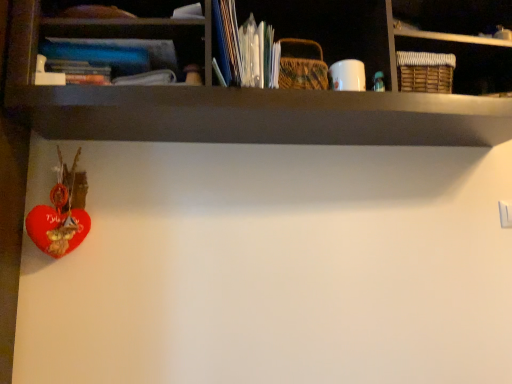
Where is `blue hardcover book at upper left`? blue hardcover book at upper left is located at coordinates (115, 54).

This screenshot has width=512, height=384. Describe the element at coordinates (115, 54) in the screenshot. I see `blue hardcover book at upper left` at that location.

Consider the image. In order to face blue hardcover book at upper left, should I rotate leftwards or rightwards?

Turn left by 19.009 degrees to look at blue hardcover book at upper left.

Locate an element on the screen. velvet red heart at lower left is located at coordinates (61, 213).

Image resolution: width=512 pixels, height=384 pixels. What do you see at coordinates (61, 213) in the screenshot? I see `velvet red heart at lower left` at bounding box center [61, 213].

This screenshot has width=512, height=384. I want to click on blue hardcover book at upper left, so click(x=115, y=54).

Considering the relative positions of blue hardcover book at upper left and velvet red heart at lower left in the image provided, is blue hardcover book at upper left to the right of velvet red heart at lower left from the viewer's perspective?

Yes, blue hardcover book at upper left is to the right of velvet red heart at lower left.

Is blue hardcover book at upper left in front of velvet red heart at lower left?

Yes, the depth of blue hardcover book at upper left is less than that of velvet red heart at lower left.

Which is in front, point (42, 42) or point (76, 241)?

The point (42, 42) is in front.

From the image's perspective, which one is positioned higher, blue hardcover book at upper left or velvet red heart at lower left?

blue hardcover book at upper left.

From a real-world perspective, which object rests below the other?

velvet red heart at lower left is physically lower.

In terms of width, does blue hardcover book at upper left look wider or thinner when compared to velvet red heart at lower left?

blue hardcover book at upper left is wider than velvet red heart at lower left.

Between blue hardcover book at upper left and velvet red heart at lower left, which one has more height?

velvet red heart at lower left.

Looking at the image, does blue hardcover book at upper left seem bigger or smaller compared to velvet red heart at lower left?

Clearly, blue hardcover book at upper left is smaller in size than velvet red heart at lower left.

Would you say blue hardcover book at upper left is inside or outside velvet red heart at lower left?

blue hardcover book at upper left is spatially situated outside velvet red heart at lower left.

Would you say blue hardcover book at upper left is a long distance from velvet red heart at lower left?

No, blue hardcover book at upper left is in close proximity to velvet red heart at lower left.

Is blue hardcover book at upper left looking in the opposite direction of velvet red heart at lower left?

No, blue hardcover book at upper left's orientation is not away from velvet red heart at lower left.

Consider the image. What's the angular difference between blue hardcover book at upper left and velvet red heart at lower left's facing directions?

The facing directions of blue hardcover book at upper left and velvet red heart at lower left are 0.0726 degrees apart.

Measure the distance between blue hardcover book at upper left and velvet red heart at lower left.

blue hardcover book at upper left and velvet red heart at lower left are 13.86 inches apart from each other.

The image size is (512, 384). What are the coordinates of `book above the velvet red heart at lower left (from the image's perspective)` in the screenshot? It's located at (115, 54).

In the scene shown: Can you confirm if velvet red heart at lower left is positioned to the left of blue hardcover book at upper left?

Correct, you'll find velvet red heart at lower left to the left of blue hardcover book at upper left.

Is velvet red heart at lower left closer to camera compared to blue hardcover book at upper left?

No, the depth of velvet red heart at lower left is greater than that of blue hardcover book at upper left.

Does point (36, 232) come farther from viewer compared to point (116, 66)?

That is False.

From the image's perspective, between velvet red heart at lower left and blue hardcover book at upper left, who is located below?

velvet red heart at lower left appears lower in the image.

From a real-world perspective, who is located higher, velvet red heart at lower left or blue hardcover book at upper left?

blue hardcover book at upper left.

Which of these two, velvet red heart at lower left or blue hardcover book at upper left, is thinner?

velvet red heart at lower left.

Is velvet red heart at lower left taller than blue hardcover book at upper left?

Correct, velvet red heart at lower left is much taller as blue hardcover book at upper left.

From the picture: Is velvet red heart at lower left bigger than blue hardcover book at upper left?

Yes.

Looking at this image, would you say velvet red heart at lower left is inside or outside blue hardcover book at upper left?

velvet red heart at lower left lies outside blue hardcover book at upper left.

Is velvet red heart at lower left far away from blue hardcover book at upper left?

They are positioned close to each other.

Could you tell me if velvet red heart at lower left is facing blue hardcover book at upper left?

No.

How many degrees apart are the facing directions of velvet red heart at lower left and blue hardcover book at upper left?

0.0726 degrees.

Find the location of a particular element. This screenshot has height=384, width=512. toy located below the blue hardcover book at upper left (from the image's perspective) is located at coordinates (61, 213).

What are the coordinates of `book in front of the velvet red heart at lower left` in the screenshot? It's located at (115, 54).

Locate an element on the screen. Image resolution: width=512 pixels, height=384 pixels. book that is on the right side of velvet red heart at lower left is located at coordinates (115, 54).